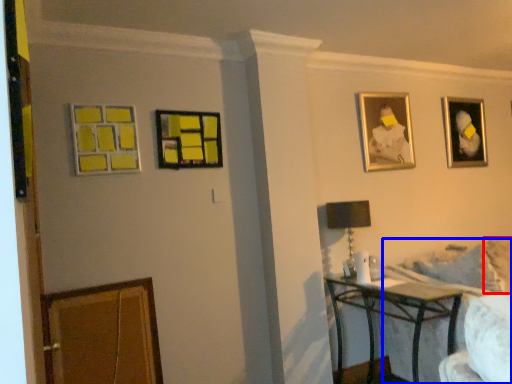
Question: Which object is further to the camera taking this photo, pillow (highlighted by a red box) or couch (highlighted by a blue box)?

Choices:
 (A) pillow
 (B) couch

Answer: (A)